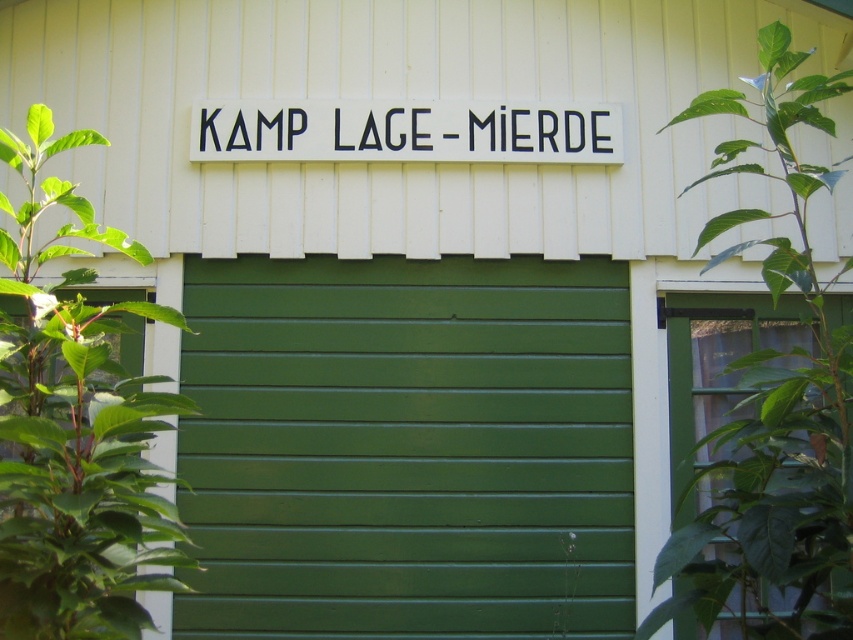
Consider the image. You are a landscape architect designing a garden around this building. The client wants to know if the green leafy plant at left can fit in a space that is the same size as the green leafy plant at upper right. Can it?

The green leafy plant at left is narrower than the green leafy plant at upper right, so it can fit in a space of the same size as the upper right plant.